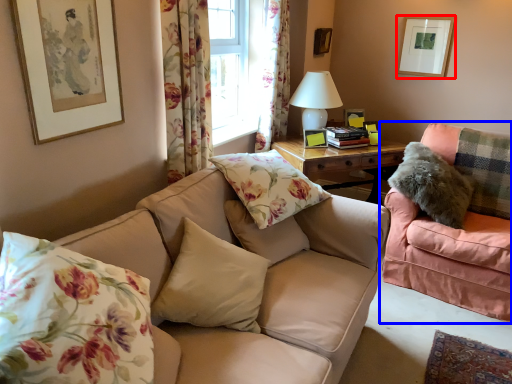
Question: Which of the following is the farthest to the observer, picture frame (highlighted by a red box) or studio couch (highlighted by a blue box)?

Choices:
 (A) picture frame
 (B) studio couch

Answer: (A)